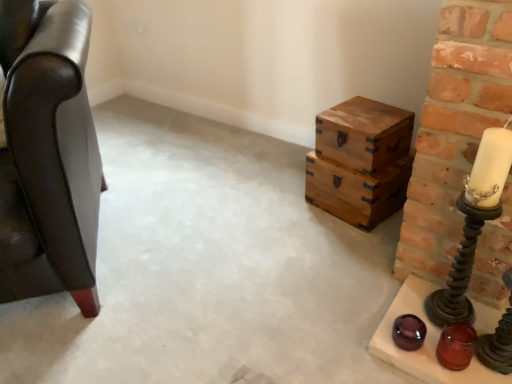
Question: From a real-world perspective, is translucent glass candle holder at lower right, which appears as the first candle holder when ordered from the bottom, below metallic spiral candlestick at right, marked as the first candle holder in a top-to-bottom arrangement?

Choices:
 (A) no
 (B) yes

Answer: (B)

Question: From the image's perspective, is translucent glass candle holder at lower right, which appears as the third candle holder when viewed from the top, located beneath metallic spiral candlestick at right, marked as the first candle holder in a top-to-bottom arrangement?

Choices:
 (A) no
 (B) yes

Answer: (B)

Question: Is translucent glass candle holder at lower right, which appears as the first candle holder when ordered from the bottom, oriented away from metallic spiral candlestick at right, marked as the 3th candle holder in a bottom-to-top arrangement?

Choices:
 (A) yes
 (B) no

Answer: (A)

Question: Can you confirm if translucent glass candle holder at lower right, which appears as the first candle holder when ordered from the bottom, is bigger than metallic spiral candlestick at right, marked as the first candle holder in a top-to-bottom arrangement?

Choices:
 (A) no
 (B) yes

Answer: (A)

Question: From the image's perspective, is translucent glass candle holder at lower right, which appears as the third candle holder when viewed from the top, above metallic spiral candlestick at right, marked as the first candle holder in a top-to-bottom arrangement?

Choices:
 (A) yes
 (B) no

Answer: (B)

Question: Does point (457, 254) appear closer or farther from the camera than point (340, 165)?

Choices:
 (A) closer
 (B) farther

Answer: (A)

Question: From the image's perspective, is metallic spiral candlestick at right, marked as the 3th candle holder in a bottom-to-top arrangement, positioned above or below wooden crates at right?

Choices:
 (A) above
 (B) below

Answer: (B)

Question: In terms of width, does metallic spiral candlestick at right, marked as the 3th candle holder in a bottom-to-top arrangement, look wider or thinner when compared to wooden crates at right?

Choices:
 (A) wide
 (B) thin

Answer: (B)

Question: Is metallic spiral candlestick at right, marked as the first candle holder in a top-to-bottom arrangement, in front of or behind wooden crates at right in the image?

Choices:
 (A) behind
 (B) front

Answer: (B)

Question: Looking at the image, does wooden crates at right seem bigger or smaller compared to translucent glass candle holder at lower right, which appears as the third candle holder when viewed from the top?

Choices:
 (A) big
 (B) small

Answer: (A)

Question: Does point (346, 124) appear closer or farther from the camera than point (450, 339)?

Choices:
 (A) closer
 (B) farther

Answer: (B)

Question: Would you say wooden crates at right is to the left or to the right of translucent glass candle holder at lower right, which appears as the first candle holder when ordered from the bottom, in the picture?

Choices:
 (A) right
 (B) left

Answer: (B)

Question: From the image's perspective, is wooden crates at right above or below translucent glass candle holder at lower right, which appears as the first candle holder when ordered from the bottom?

Choices:
 (A) below
 (B) above

Answer: (B)

Question: Would you say shiny dark brown candle holder at right, the second candle holder positioned from the bottom, is inside or outside metallic spiral candlestick at right, marked as the first candle holder in a top-to-bottom arrangement?

Choices:
 (A) inside
 (B) outside

Answer: (B)

Question: From the image's perspective, is shiny dark brown candle holder at right, acting as the 2th candle holder starting from the top, located above or below metallic spiral candlestick at right, marked as the 3th candle holder in a bottom-to-top arrangement?

Choices:
 (A) above
 (B) below

Answer: (B)